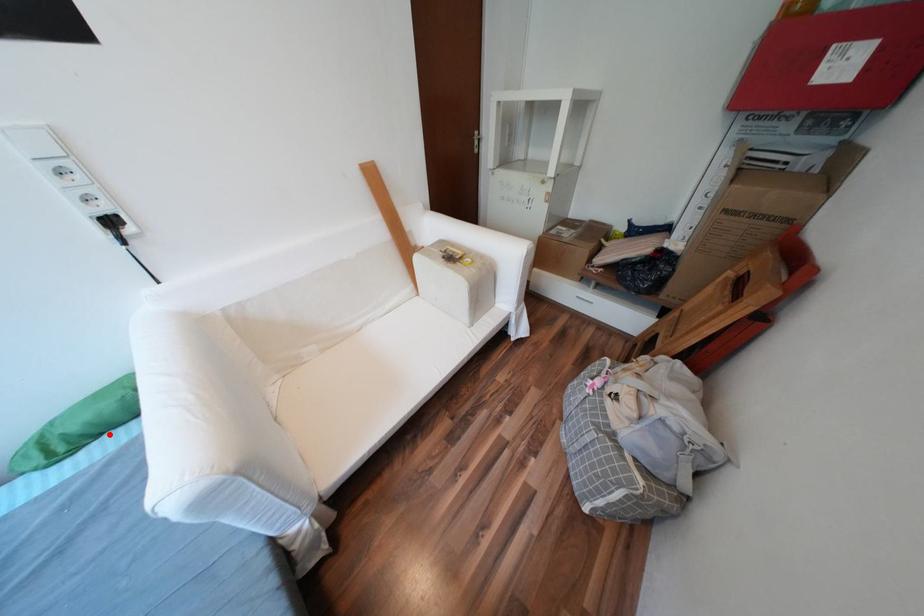
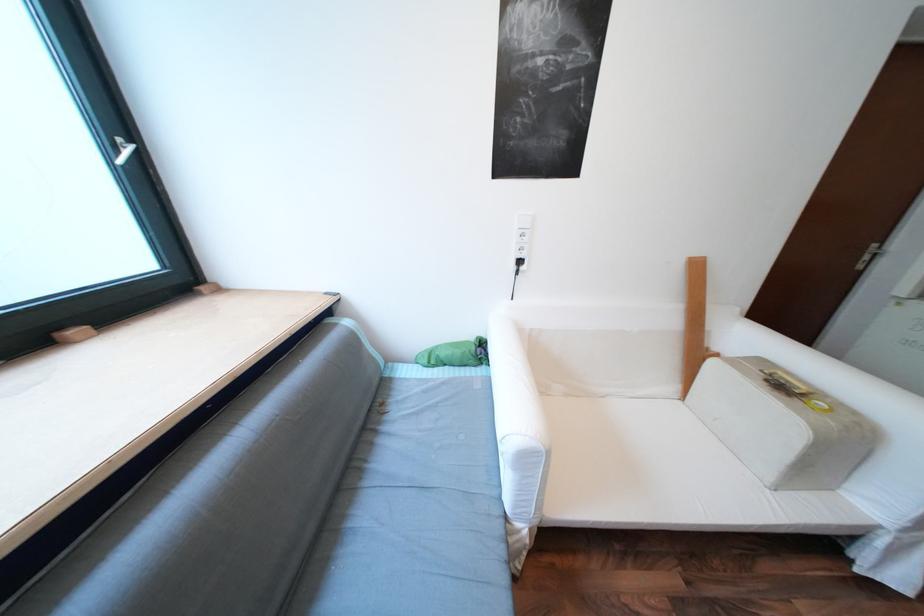
Where in the second image is the point corresponding to the highlighted location from the first image?

(455, 365)